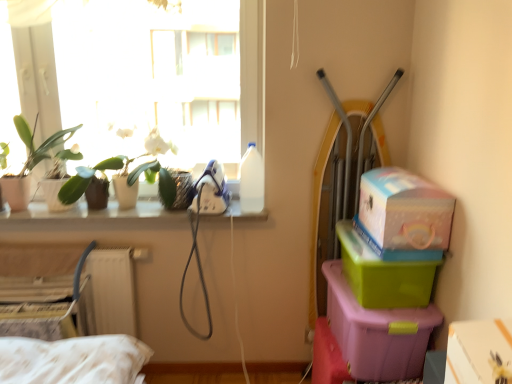
This screenshot has height=384, width=512. I want to click on vacant space situated above white textured bed at lower left (from a real-world perspective), so click(73, 247).